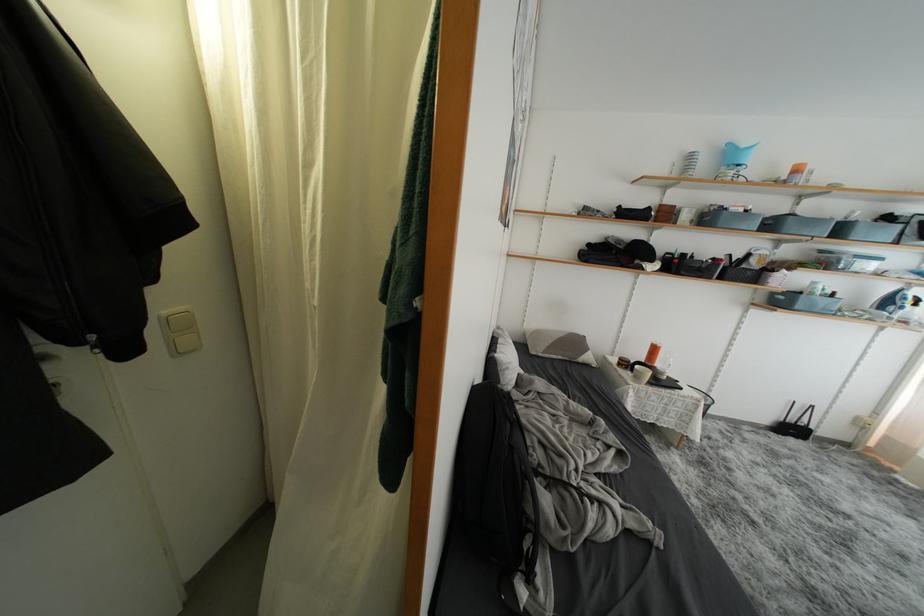
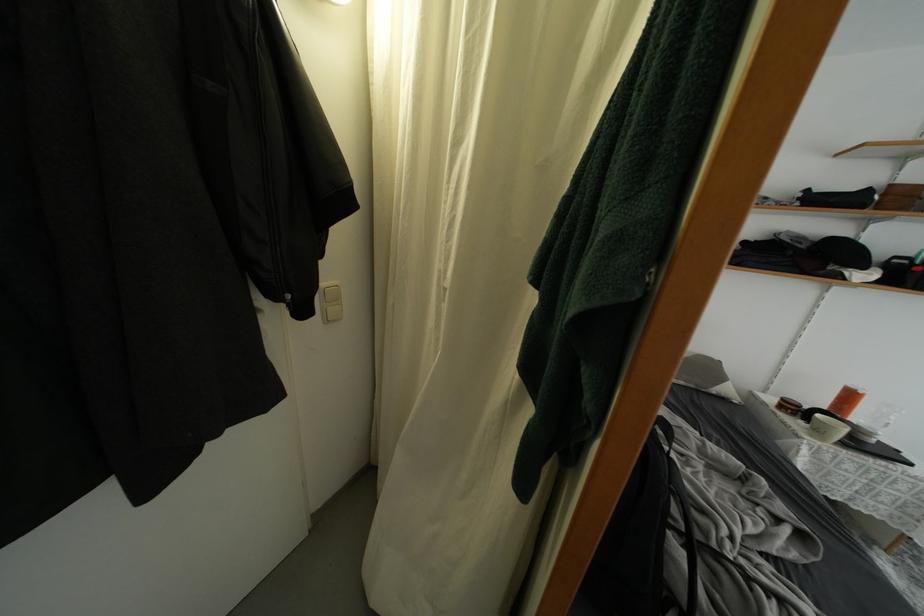
Locate, in the second image, the point that corresponds to point (131, 354) in the first image.

(310, 315)